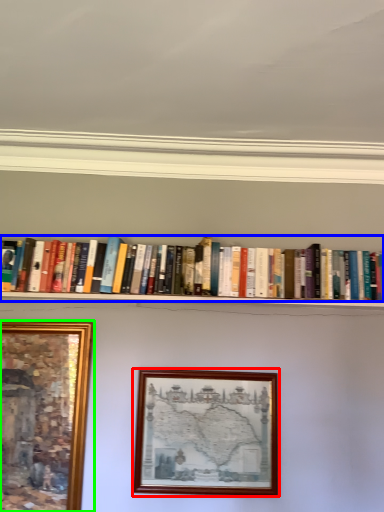
Question: Estimate the real-world distances between objects in this image. Which object is farther from picture frame (highlighted by a red box), book (highlighted by a blue box) or picture frame (highlighted by a green box)?

Choices:
 (A) book
 (B) picture frame

Answer: (A)